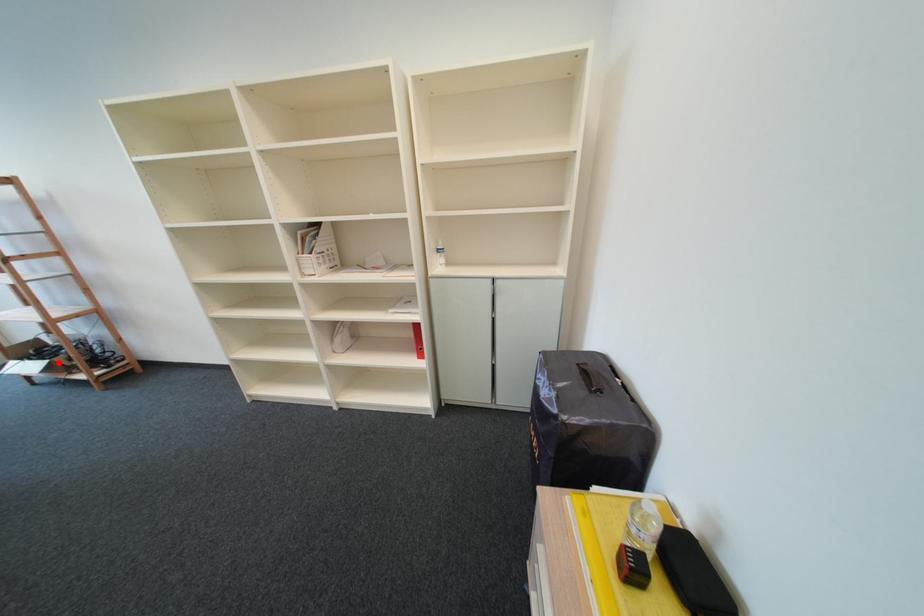
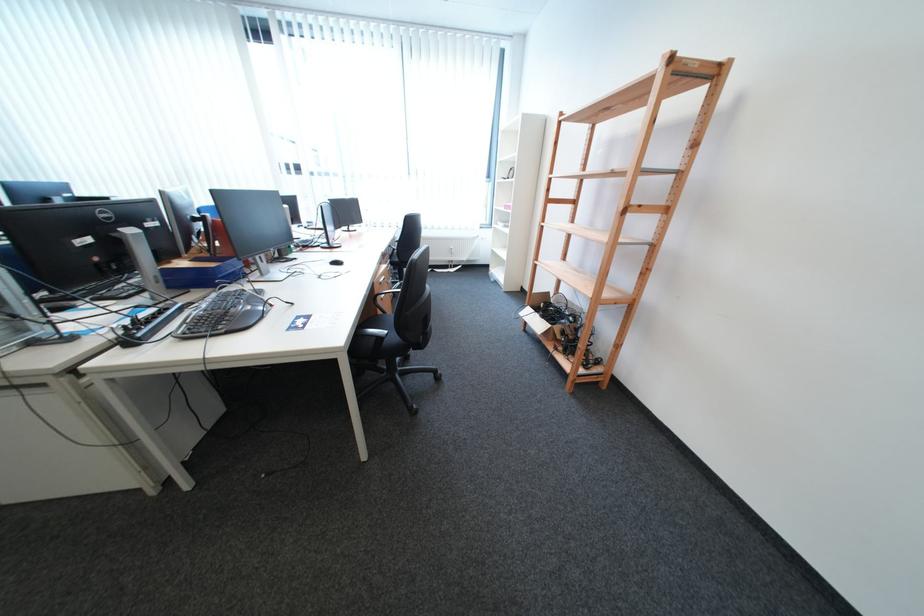
Question: A red point is marked in image1. In image2, is the corresponding 3D point closer to the camera or farther? Reply with the corresponding letter.

Choices:
 (A) The corresponding 3D point is closer.
 (B) The corresponding 3D point is farther.

Answer: (B)